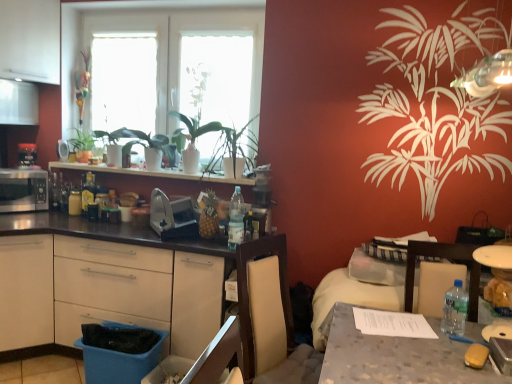
Identify the location of spots to the right of metallic silver toaster at upper left, the third appliance viewed from the left. (79, 163).